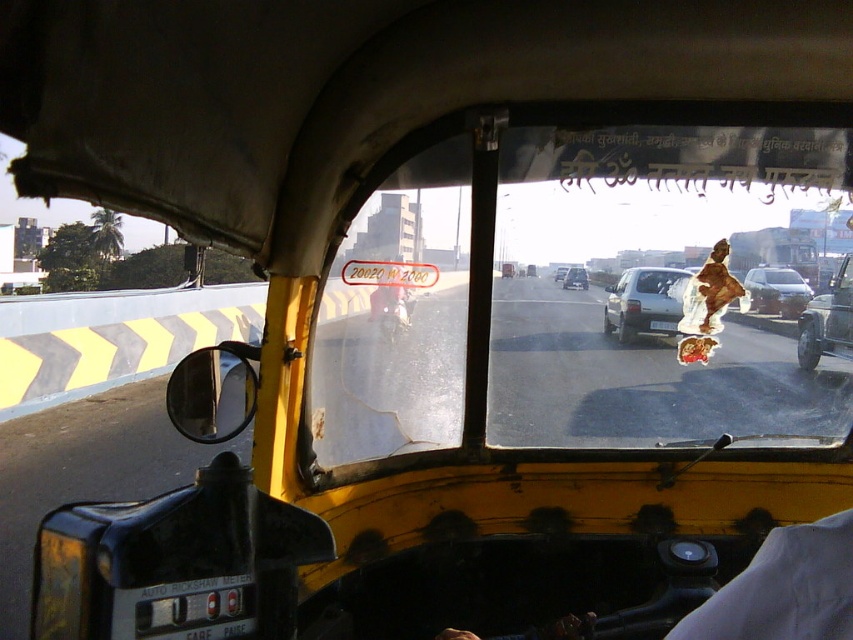
Question: Among these points, which one is farthest from the camera?

Choices:
 (A) (450, 339)
 (B) (782, 273)
 (C) (834, 321)

Answer: (C)

Question: Which of the following is the closest to the observer?

Choices:
 (A) silver metallic sedan at center
 (B) satin silver sedan at center

Answer: (B)

Question: Which point is farther from the camera taking this photo?

Choices:
 (A) (755, 275)
 (B) (816, 349)

Answer: (B)

Question: Does metallic silver car at right appear on the left side of silver metallic sedan at center?

Choices:
 (A) yes
 (B) no

Answer: (B)

Question: Is transparent plastic windshield at center thinner than satin silver sedan at center?

Choices:
 (A) yes
 (B) no

Answer: (B)

Question: Is metallic silver car at right smaller than satin silver sedan at center?

Choices:
 (A) no
 (B) yes

Answer: (A)